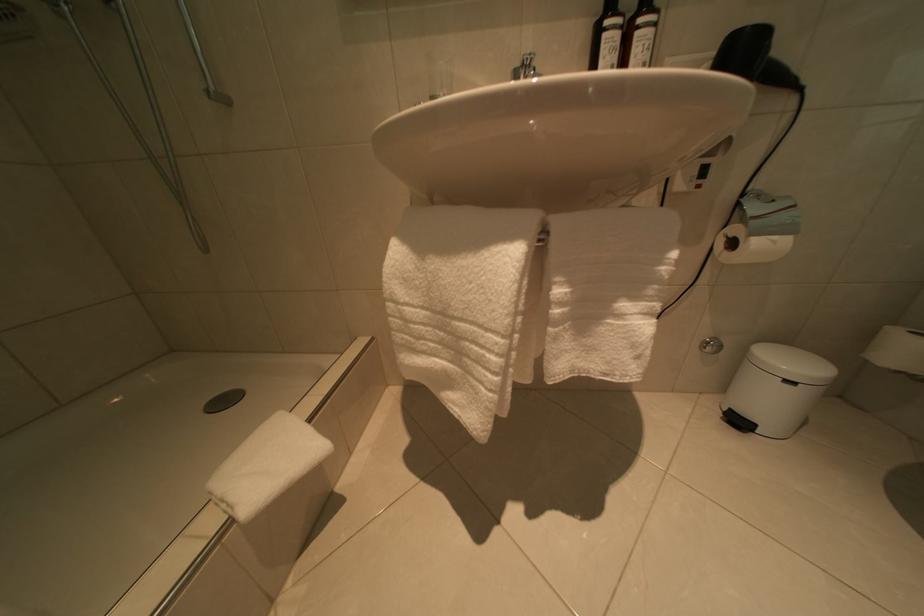
What do you see at coordinates (755, 58) in the screenshot? The height and width of the screenshot is (616, 924). I see `the black hairdryer` at bounding box center [755, 58].